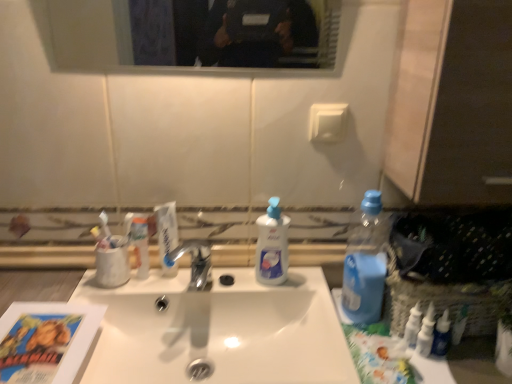
Where is `vacant area that is situated to the right of white glossy liquid soap at center`? vacant area that is situated to the right of white glossy liquid soap at center is located at coordinates (310, 288).